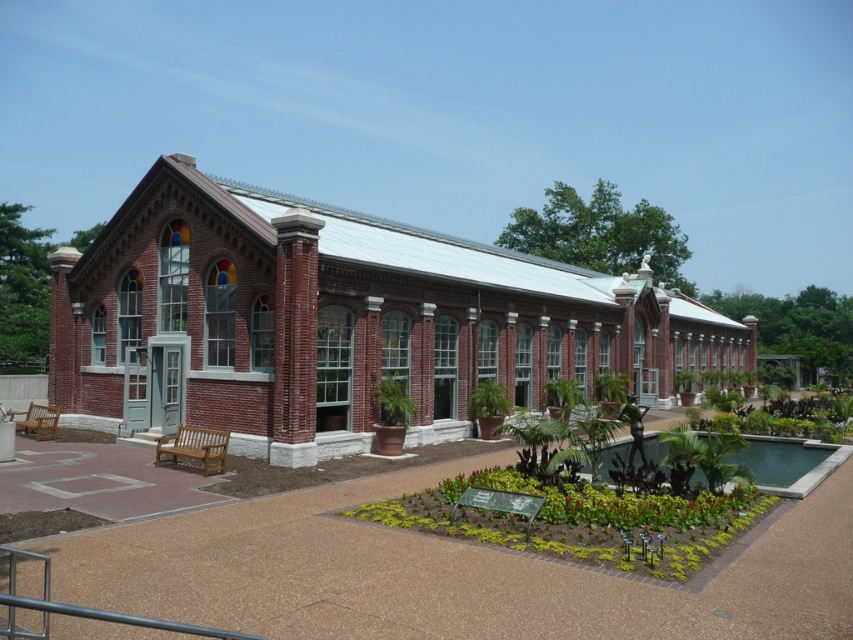
You are standing at the entrance of the red brick chapel at center. If you walk straight ahead, will you exit the building through the main entrance or enter the garden area?

The red brick chapel at center is located at point (338, 323), which places it centrally. Walking straight ahead from the entrance would lead you out of the building through the main entrance, not into the garden area.

You are planning to install a new lighting system for the red brick chapel at center and the green concrete pool at center. Since the lighting fixtures need to be placed at different heights based on their sizes, which object requires the lighting fixtures to be installed higher?

The red brick chapel at center requires the lighting fixtures to be installed higher because it has a greater height compared to the green concrete pool at center.

You are standing in front of the red brick chapel at center and the green concrete pool at center. Which one is more to the left?

The red brick chapel at center is more to the left than the green concrete pool at center.